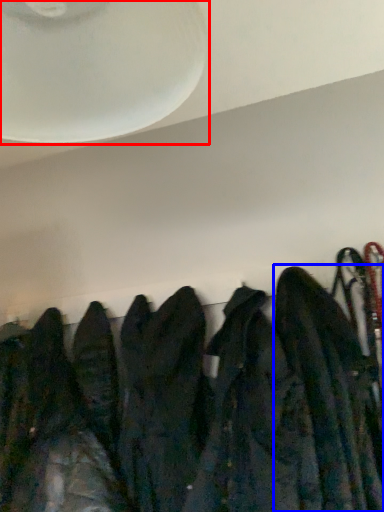
Question: Which point is closer to the camera, fan (highlighted by a red box) or jacket (highlighted by a blue box)?

Choices:
 (A) fan
 (B) jacket

Answer: (A)